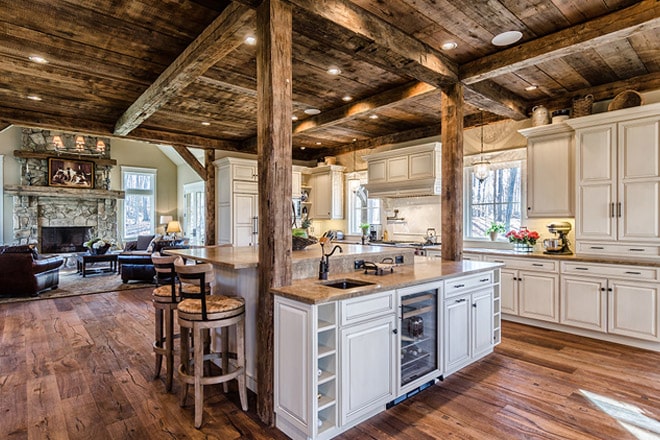
Identify the location of places to sit. (220, 303), (187, 290), (28, 273), (141, 255).